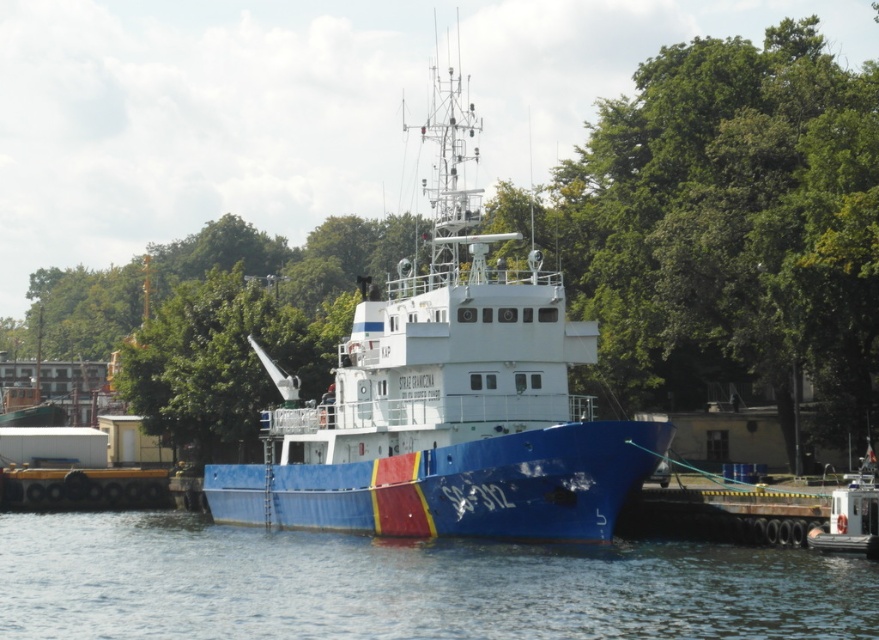
Question: Among these objects, which one is farthest from the camera?

Choices:
 (A) blue glossy water at lower center
 (B) blue matte boat at center
 (C) green leafy tree at upper left

Answer: (C)

Question: Which point is farther to the camera?

Choices:
 (A) blue matte boat at center
 (B) blue glossy water at lower center
 (C) green leafy tree at upper left

Answer: (C)

Question: Is blue matte boat at center in front of green leafy tree at upper left?

Choices:
 (A) yes
 (B) no

Answer: (A)

Question: Can you confirm if blue glossy water at lower center is smaller than green leafy tree at upper left?

Choices:
 (A) yes
 (B) no

Answer: (A)

Question: Considering the real-world distances, which object is closest to the blue glossy water at lower center?

Choices:
 (A) green leafy tree at upper left
 (B) blue matte boat at center

Answer: (B)

Question: Is blue matte boat at center positioned at the back of blue glossy water at lower center?

Choices:
 (A) yes
 (B) no

Answer: (A)